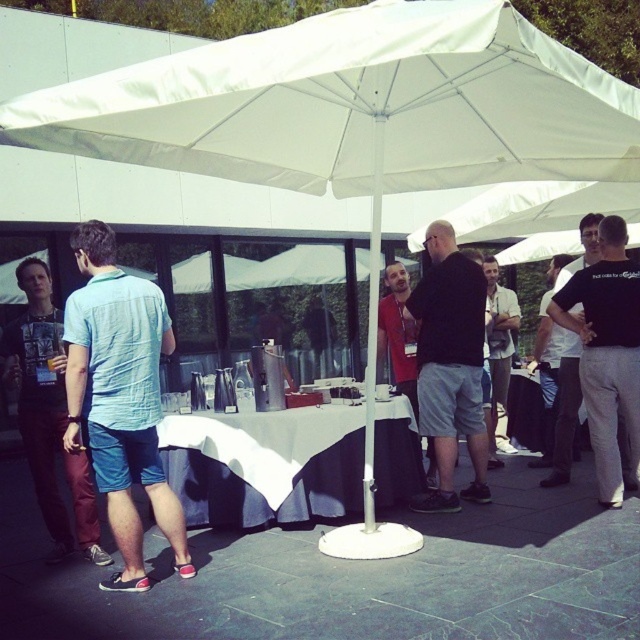
Question: Which point is farther from the camera taking this photo?

Choices:
 (A) (355, 481)
 (B) (492, 349)
 (C) (77, 493)

Answer: (B)

Question: Is the position of black matte shirt at center more distant than that of black cotton t-shirt at right?

Choices:
 (A) no
 (B) yes

Answer: (B)

Question: Does black cotton t-shirt at right appear under matte black shirt at center?

Choices:
 (A) no
 (B) yes

Answer: (A)

Question: Which point appears farthest from the camera in this image?

Choices:
 (A) (x=70, y=493)
 (B) (x=403, y=442)
 (C) (x=129, y=547)
 (D) (x=634, y=353)

Answer: (A)

Question: Can you confirm if black cotton t-shirt at right is smaller than light blue denim shorts at center?

Choices:
 (A) yes
 (B) no

Answer: (B)

Question: Which of these objects is positioned closest to the matte black shirt at center?

Choices:
 (A) black cotton t-shirt at right
 (B) light blue denim shorts at center
 (C) white cloth at center
 (D) black matte shirt at center

Answer: (D)